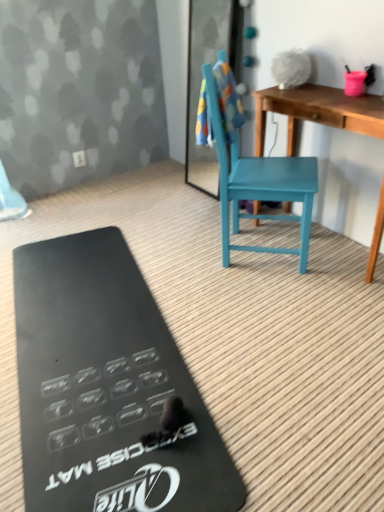
The image size is (384, 512). What do you see at coordinates (259, 182) in the screenshot?
I see `teal wood chair at center` at bounding box center [259, 182].

At what (x,y) coordinates should I click in order to perform the action: click on wooden desk at center. Please return your answer as a coordinate pair (x, y). The image size is (384, 512). Looking at the image, I should click on tap(317, 112).

I want to click on multicolored fabric towel at upper center, so click(228, 98).

The height and width of the screenshot is (512, 384). I want to click on teal wood chair at center, so click(x=259, y=182).

Is wooden desk at center completely or partially inside white plastic power outlet at upper center?

Definitely not — wooden desk at center is not inside white plastic power outlet at upper center.

From the image's perspective, is white plastic power outlet at upper center positioned above or below wooden desk at center?

Based on their image positions, white plastic power outlet at upper center is located above wooden desk at center.

Which object is wider, white plastic power outlet at upper center or wooden desk at center?

wooden desk at center.

Considering the relative sizes of white plastic power outlet at upper center and wooden desk at center in the image provided, is white plastic power outlet at upper center shorter than wooden desk at center?

Yes, white plastic power outlet at upper center is shorter than wooden desk at center.

How different are the orientations of black rubber exercise mat at lower left and wooden desk at center in degrees?

black rubber exercise mat at lower left and wooden desk at center are facing 75 degrees away from each other.

Is black rubber exercise mat at lower left to the left of wooden desk at center from the viewer's perspective?

Correct, you'll find black rubber exercise mat at lower left to the left of wooden desk at center.

The image size is (384, 512). I want to click on desk behind the black rubber exercise mat at lower left, so click(x=317, y=112).

Which is less distant, [76,508] or [288,207]?

Point [76,508] appears to be closer to the viewer than point [288,207].

Looking at this image, is the position of black rubber exercise mat at lower left less distant than that of multicolored fabric towel at upper center?

Yes, black rubber exercise mat at lower left is in front of multicolored fabric towel at upper center.

Which of these two, black rubber exercise mat at lower left or multicolored fabric towel at upper center, is smaller?

With smaller size is multicolored fabric towel at upper center.

From the image's perspective, would you say black rubber exercise mat at lower left is shown under multicolored fabric towel at upper center?

Yes, from the image's perspective, black rubber exercise mat at lower left is below multicolored fabric towel at upper center.

Would you consider black rubber exercise mat at lower left to be distant from multicolored fabric towel at upper center?

Absolutely, black rubber exercise mat at lower left is distant from multicolored fabric towel at upper center.

Does multicolored fabric towel at upper center lie behind wooden desk at center?

Yes, it is behind wooden desk at center.

In the scene shown: Measure the distance between multicolored fabric towel at upper center and wooden desk at center.

The distance of multicolored fabric towel at upper center from wooden desk at center is 33.53 centimeters.

Considering the relative sizes of multicolored fabric towel at upper center and wooden desk at center in the image provided, is multicolored fabric towel at upper center wider than wooden desk at center?

No, multicolored fabric towel at upper center is not wider than wooden desk at center.

The width and height of the screenshot is (384, 512). I want to click on power outlet behind the wooden desk at center, so click(x=79, y=159).

From the image's perspective, is wooden desk at center on top of white plastic power outlet at upper center?

No, from the image's perspective, wooden desk at center is not over white plastic power outlet at upper center.

Which is further, (362, 106) or (75, 159)?

The point (75, 159) is more distant.

In the scene shown: How different are the orientations of black rubber exercise mat at lower left and white plastic power outlet at upper center in degrees?

There is a 15.6-degree angle between the facing directions of black rubber exercise mat at lower left and white plastic power outlet at upper center.

Are black rubber exercise mat at lower left and white plastic power outlet at upper center located far from each other?

Absolutely, black rubber exercise mat at lower left is distant from white plastic power outlet at upper center.

From a real-world perspective, who is located lower, black rubber exercise mat at lower left or white plastic power outlet at upper center?

From a 3D spatial view, black rubber exercise mat at lower left is below.

Is black rubber exercise mat at lower left further to the viewer compared to white plastic power outlet at upper center?

No, it is not.

Is white plastic power outlet at upper center positioned beyond the bounds of multicolored fabric towel at upper center?

That's correct, white plastic power outlet at upper center is outside of multicolored fabric towel at upper center.

Looking at this image, from a real-world perspective, which is physically above, white plastic power outlet at upper center or multicolored fabric towel at upper center?

In real-world perspective, multicolored fabric towel at upper center is above.

Visually, is white plastic power outlet at upper center positioned to the left or to the right of multicolored fabric towel at upper center?

white plastic power outlet at upper center is to the left of multicolored fabric towel at upper center.

From the image's perspective, which is above, white plastic power outlet at upper center or multicolored fabric towel at upper center?

white plastic power outlet at upper center appears higher in the image.

The image size is (384, 512). In order to click on desk below the white plastic power outlet at upper center (from the image's perspective) in this screenshot , I will do pyautogui.click(x=317, y=112).

Image resolution: width=384 pixels, height=512 pixels. Identify the location of clipboard located underneath the wooden desk at center (from a real-world perspective). (106, 388).

Based on their spatial positions, is teal wood chair at center or white plastic power outlet at upper center further from black rubber exercise mat at lower left?

white plastic power outlet at upper center is positioned further to the anchor black rubber exercise mat at lower left.

Looking at the image, which one is located closer to multicolored fabric towel at upper center, wooden desk at center or black rubber exercise mat at lower left?

wooden desk at center is positioned closer to the anchor multicolored fabric towel at upper center.

From the image, which object appears to be nearer to white plastic power outlet at upper center, teal wood chair at center or multicolored fabric towel at upper center?

multicolored fabric towel at upper center.

In the scene shown: From the image, which object appears to be nearer to wooden desk at center, white plastic power outlet at upper center or multicolored fabric towel at upper center?

Among the two, multicolored fabric towel at upper center is located nearer to wooden desk at center.

Which object lies nearer to the anchor point white plastic power outlet at upper center, black rubber exercise mat at lower left or wooden desk at center?

Among the two, wooden desk at center is located nearer to white plastic power outlet at upper center.

From the image, which object appears to be farther from multicolored fabric towel at upper center, wooden desk at center or white plastic power outlet at upper center?

Among the two, white plastic power outlet at upper center is located further to multicolored fabric towel at upper center.

Considering their positions, is white plastic power outlet at upper center positioned further to wooden desk at center than black rubber exercise mat at lower left?

white plastic power outlet at upper center is positioned further to the anchor wooden desk at center.

Estimate the real-world distances between objects in this image. Which object is closer to black rubber exercise mat at lower left, white plastic power outlet at upper center or wooden desk at center?

wooden desk at center.

Identify the location of towel/napkin between wooden desk at center and white plastic power outlet at upper center along the z-axis. This screenshot has width=384, height=512. (228, 98).

The height and width of the screenshot is (512, 384). Identify the location of armchair located between black rubber exercise mat at lower left and wooden desk at center in the left-right direction. (259, 182).

Where is `armchair between multicolored fabric towel at upper center and black rubber exercise mat at lower left vertically`? Image resolution: width=384 pixels, height=512 pixels. armchair between multicolored fabric towel at upper center and black rubber exercise mat at lower left vertically is located at coordinates (259, 182).

The height and width of the screenshot is (512, 384). Find the location of `desk between black rubber exercise mat at lower left and white plastic power outlet at upper center in the front-back direction`. desk between black rubber exercise mat at lower left and white plastic power outlet at upper center in the front-back direction is located at coordinates (317, 112).